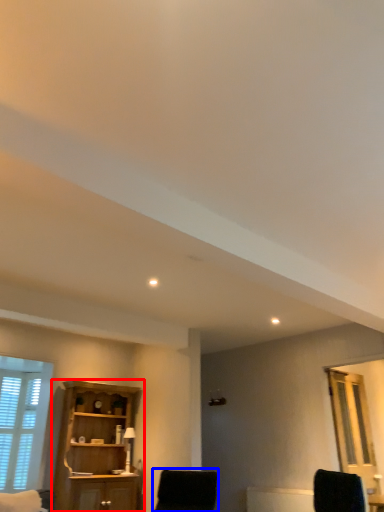
Question: Among these objects, which one is farthest to the camera, cupboard (highlighted by a red box) or chair (highlighted by a blue box)?

Choices:
 (A) cupboard
 (B) chair

Answer: (A)